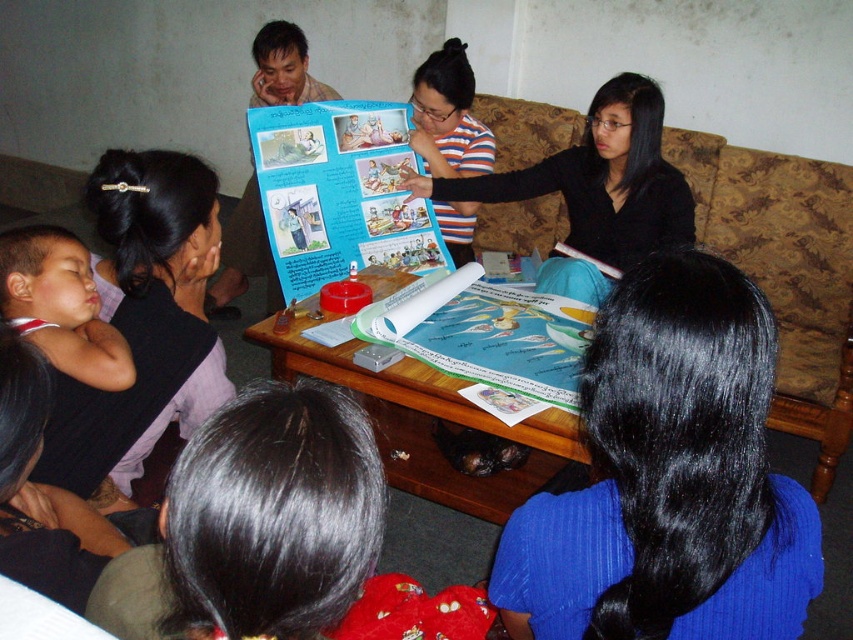
Question: Observing the image, what is the correct spatial positioning of blue fabric hair at lower right in reference to wooden table at center?

Choices:
 (A) left
 (B) right

Answer: (B)

Question: Is blue fabric hair at lower right to the left of wooden table at center from the viewer's perspective?

Choices:
 (A) no
 (B) yes

Answer: (A)

Question: Which object appears farthest from the camera in this image?

Choices:
 (A) wooden table at center
 (B) black matte poster at center
 (C) blue fabric hair at lower right

Answer: (B)

Question: Is blue fabric hair at lower right further to camera compared to black matte poster at center?

Choices:
 (A) yes
 (B) no

Answer: (B)

Question: Which object is positioned farthest from the blue fabric hair at lower right?

Choices:
 (A) wooden table at center
 (B) black matte poster at center

Answer: (B)

Question: Which object appears closest to the camera in this image?

Choices:
 (A) blue fabric hair at lower right
 (B) black matte poster at center

Answer: (A)